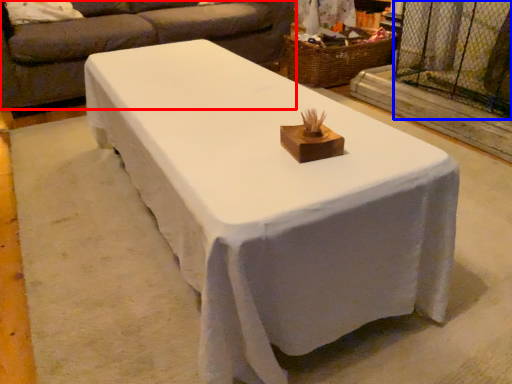
Question: Which object appears closest to the camera in this image, studio couch (highlighted by a red box) or screen door (highlighted by a blue box)?

Choices:
 (A) studio couch
 (B) screen door

Answer: (B)